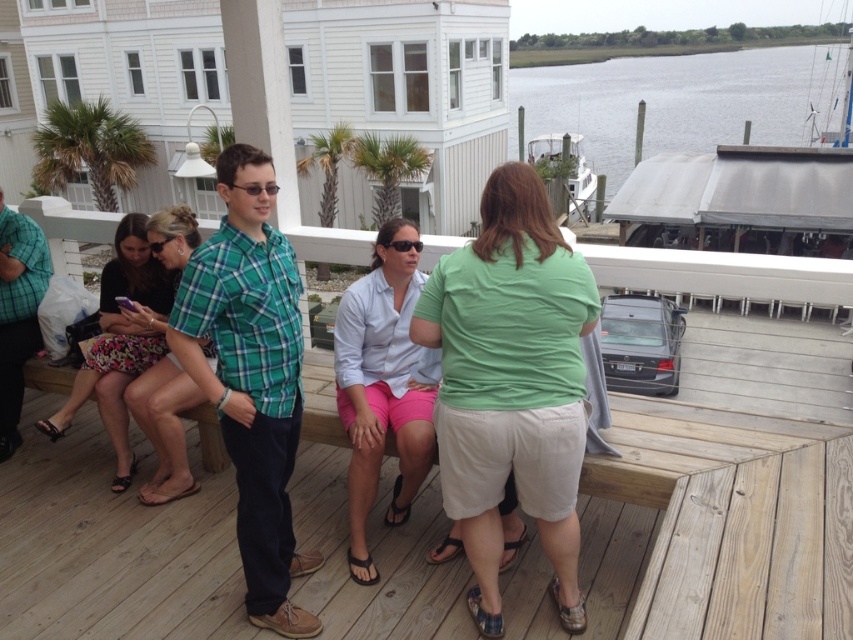
What is located at the coordinates point (511, 385)?

The green cotton shirt at center is located at point (511, 385).

You are trying to find the person wearing the green cotton shirt at center in the group on the wooden deck. Which direction should you look relative to the green plaid shirt at center?

The green cotton shirt at center is positioned on the right side of the green plaid shirt at center, so you should look to the right of the green plaid shirt at center to find the green cotton shirt at center.

You are standing on the wooden deck and want to know which object, the gray water at upper right or the white glossy boat at upper right, is higher in the image. Which one is taller?

The gray water at upper right is taller than the white glossy boat at upper right according to the description.